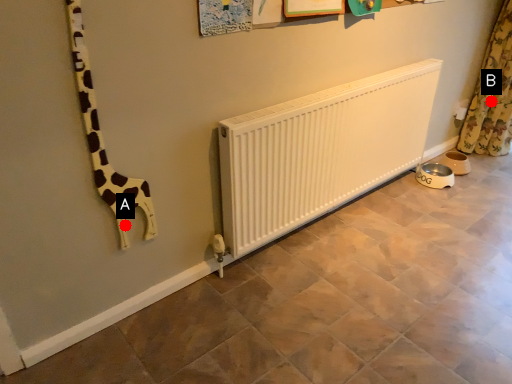
Question: Two points are circled on the image, labeled by A and B beside each circle. Among these points, which one is nearest to the camera?

Choices:
 (A) A is closer
 (B) B is closer

Answer: (A)